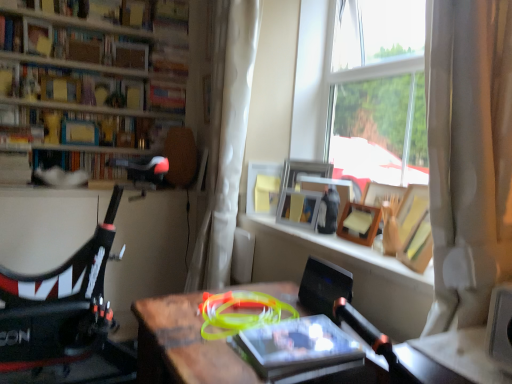
Question: Is hardcover book at upper center, the 4th book when ordered from bottom to top, far from wooden picture frame at window, the 4th picture frame positioned from the left?

Choices:
 (A) no
 (B) yes

Answer: (B)

Question: Considering the relative sizes of hardcover book at upper center, the 1th book from the back, and wooden picture frame at window, placed as the first picture frame when sorted from right to left, in the image provided, is hardcover book at upper center, the 1th book from the back, smaller than wooden picture frame at window, placed as the first picture frame when sorted from right to left,?

Choices:
 (A) yes
 (B) no

Answer: (B)

Question: From a real-world perspective, is hardcover book at upper center, marked as the 2th book in a top-to-bottom arrangement, located higher than wooden picture frame at window, placed as the first picture frame when sorted from right to left?

Choices:
 (A) yes
 (B) no

Answer: (A)

Question: Can you confirm if hardcover book at upper center, acting as the 5th book starting from the front, is shorter than wooden picture frame at window, placed as the first picture frame when sorted from right to left?

Choices:
 (A) yes
 (B) no

Answer: (A)

Question: Is hardcover book at upper center, acting as the 5th book starting from the front, closer to the viewer compared to wooden picture frame at window, the 4th picture frame positioned from the left?

Choices:
 (A) yes
 (B) no

Answer: (B)

Question: Choose the correct answer: Is wooden desk at center inside white sheer curtain at center or outside it?

Choices:
 (A) outside
 (B) inside

Answer: (A)

Question: Looking at the image, does wooden desk at center seem bigger or smaller compared to white sheer curtain at center?

Choices:
 (A) small
 (B) big

Answer: (A)

Question: Is point (192, 382) closer or farther from the camera than point (234, 125)?

Choices:
 (A) closer
 (B) farther

Answer: (A)

Question: Looking at their shapes, would you say wooden desk at center is wider or thinner than white sheer curtain at center?

Choices:
 (A) wide
 (B) thin

Answer: (A)

Question: Considering the positions of point pyautogui.click(x=303, y=210) and point pyautogui.click(x=365, y=268), is point pyautogui.click(x=303, y=210) closer or farther from the camera than point pyautogui.click(x=365, y=268)?

Choices:
 (A) closer
 (B) farther

Answer: (B)

Question: From a real-world perspective, is wooden picture frame at upper right, placed as the 2th picture frame when sorted from left to right, physically located above or below wooden frame at upper center?

Choices:
 (A) below
 (B) above

Answer: (B)

Question: Is wooden picture frame at upper right, placed as the 2th picture frame when sorted from left to right, spatially inside wooden frame at upper center, or outside of it?

Choices:
 (A) outside
 (B) inside

Answer: (A)

Question: In terms of size, does wooden picture frame at upper right, placed as the 2th picture frame when sorted from left to right, appear bigger or smaller than wooden frame at upper center?

Choices:
 (A) small
 (B) big

Answer: (A)

Question: Is wooden picture frame at upper right, placed as the 2th picture frame when sorted from left to right, in front of or behind wooden picture frame at window, which is counted as the second picture frame, starting from the right, in the image?

Choices:
 (A) behind
 (B) front

Answer: (A)

Question: Looking at the image, does wooden picture frame at upper right, which is counted as the third picture frame, starting from the right, seem bigger or smaller compared to wooden picture frame at window, which appears as the third picture frame when viewed from the left?

Choices:
 (A) big
 (B) small

Answer: (B)